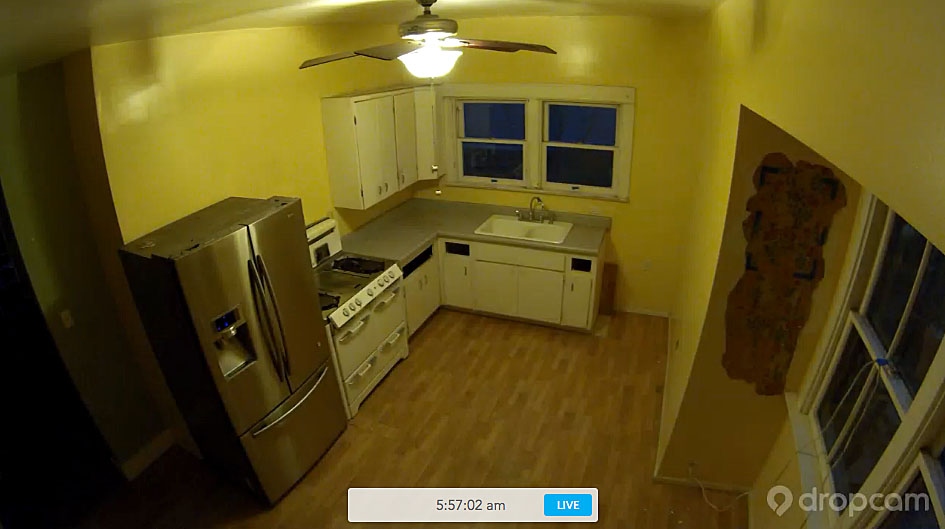
Where is `room light`? room light is located at coordinates (438, 63).